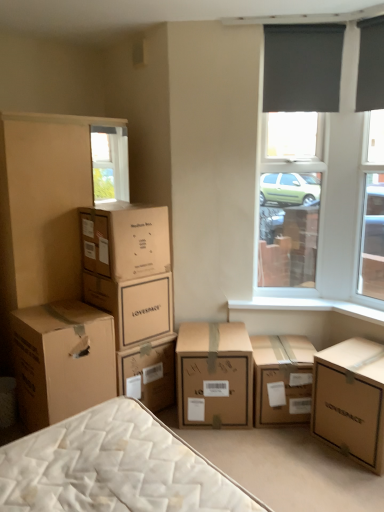
Question: Considering the relative sizes of brown cardboard box at lower left, the 6th box when ordered from right to left, and brown cardboard box at center-left, the 4th box when ordered from right to left, in the image provided, is brown cardboard box at lower left, the 6th box when ordered from right to left, shorter than brown cardboard box at center-left, the 4th box when ordered from right to left,?

Choices:
 (A) yes
 (B) no

Answer: (B)

Question: Would you consider brown cardboard box at lower left, the 6th box when ordered from right to left, to be distant from brown cardboard box at center-left, the 3th box viewed from the left?

Choices:
 (A) no
 (B) yes

Answer: (A)

Question: Is brown cardboard box at lower left, the 6th box when ordered from right to left, oriented away from brown cardboard box at center-left, the 3th box viewed from the left?

Choices:
 (A) yes
 (B) no

Answer: (B)

Question: Can you confirm if brown cardboard box at lower left, the 1th box from the left, is wider than brown cardboard box at center-left, the 4th box when ordered from right to left?

Choices:
 (A) yes
 (B) no

Answer: (A)

Question: Can you confirm if brown cardboard box at lower left, the 1th box from the left, is thinner than brown cardboard box at center-left, the 3th box viewed from the left?

Choices:
 (A) no
 (B) yes

Answer: (A)

Question: Considering their positions, is brown cardboard box at center, acting as the second box starting from the right, located in front of or behind lovespace cardboard box at lower right, acting as the first box starting from the right?

Choices:
 (A) behind
 (B) front

Answer: (A)

Question: Based on their sizes in the image, would you say brown cardboard box at center, acting as the second box starting from the right, is bigger or smaller than lovespace cardboard box at lower right, which is counted as the sixth box, starting from the left?

Choices:
 (A) big
 (B) small

Answer: (B)

Question: Considering the positions of brown cardboard box at center, marked as the fifth box in a left-to-right arrangement, and lovespace cardboard box at lower right, acting as the first box starting from the right, in the image, is brown cardboard box at center, marked as the fifth box in a left-to-right arrangement, taller or shorter than lovespace cardboard box at lower right, acting as the first box starting from the right,?

Choices:
 (A) tall
 (B) short

Answer: (B)

Question: From the image's perspective, is brown cardboard box at center, marked as the fifth box in a left-to-right arrangement, positioned above or below lovespace cardboard box at lower right, which is counted as the sixth box, starting from the left?

Choices:
 (A) below
 (B) above

Answer: (B)

Question: Looking at their shapes, would you say brown cardboard box at lower left, the 6th box when ordered from right to left, is wider or thinner than dark gray fabric at upper right?

Choices:
 (A) wide
 (B) thin

Answer: (A)

Question: From a real-world perspective, is brown cardboard box at lower left, the 1th box from the left, above or below dark gray fabric at upper right?

Choices:
 (A) below
 (B) above

Answer: (A)

Question: Which is correct: brown cardboard box at lower left, the 6th box when ordered from right to left, is inside dark gray fabric at upper right, or outside of it?

Choices:
 (A) outside
 (B) inside

Answer: (A)

Question: From their relative heights in the image, would you say brown cardboard box at lower left, the 6th box when ordered from right to left, is taller or shorter than dark gray fabric at upper right?

Choices:
 (A) short
 (B) tall

Answer: (B)

Question: Is point (286, 366) positioned closer to the camera than point (102, 270)?

Choices:
 (A) farther
 (B) closer

Answer: (B)

Question: Considering the relative positions of brown cardboard box at center, acting as the second box starting from the right, and brown cardboard box at upper left, placed as the 5th box when sorted from right to left, in the image provided, is brown cardboard box at center, acting as the second box starting from the right, to the left or to the right of brown cardboard box at upper left, placed as the 5th box when sorted from right to left,?

Choices:
 (A) left
 (B) right

Answer: (B)